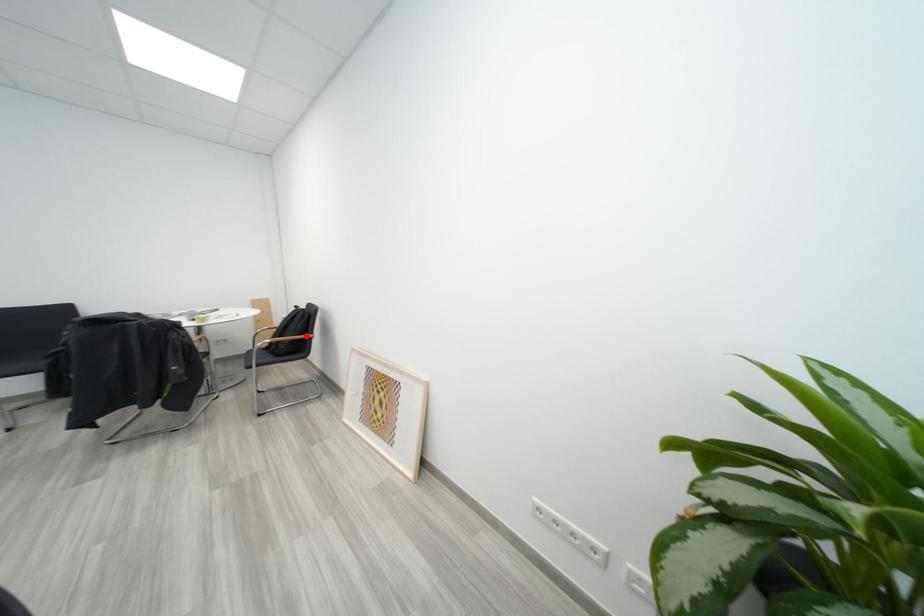
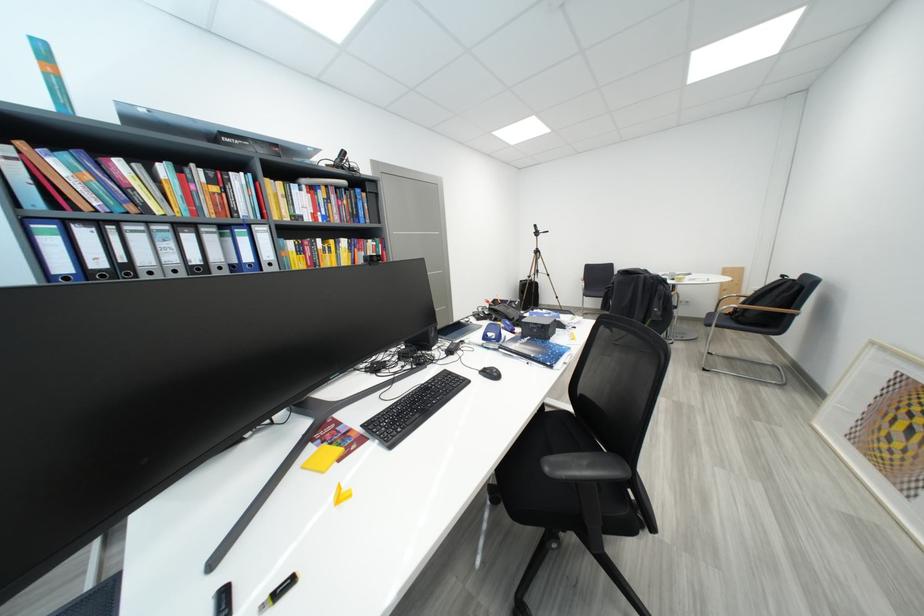
Where in the second image is the point corresponding to the highlighted location from the first image?

(783, 310)